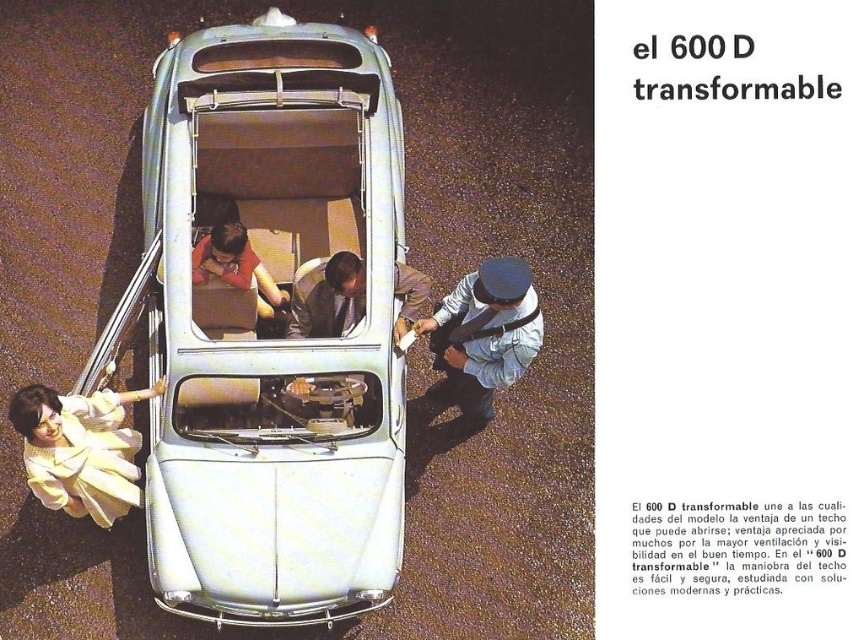
You are a photographer adjusting your camera to focus on two points in the image of the car. The first point is point [429,324] and the second is point [313,312]. Which point should you focus on first if you want to start with the one closer to the camera?

Point [313,312] is closer to the camera than point [429,324], so you should focus on point [313,312] first.

Consider the image. You are a photographer standing at the location of the camera in the image. You want to retrieve your light blue denim jacket at center without moving the camera. Is it possible to reach the jacket while staying in place?

The light blue denim jacket at center and camera are 9.64 meters apart. Since the distance is over 9 meters, you cannot reach the jacket while staying at the camera position.

You are a photographer standing in front of the vintage advertisement. You notice the silver metallic car at center and the light brown leather jacket at center. Which object is positioned lower in the image?

The silver metallic car at center is located below the light brown leather jacket at center, so it is positioned lower in the image.